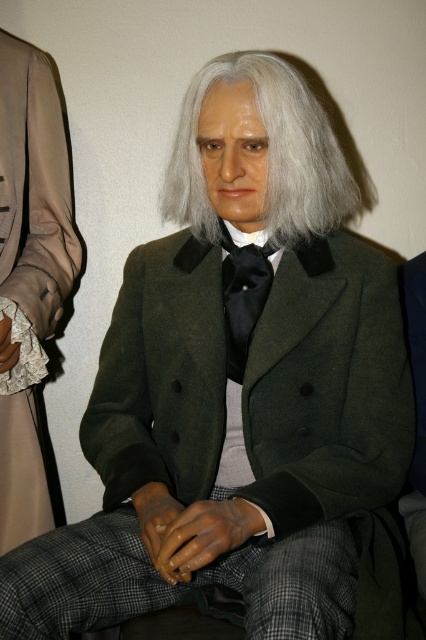
Based on the photo, you are a museum visitor standing in front of two wax figures. You notice the gray matte hair at center and the black satin tie at center. Which object is positioned to the right of the other?

The gray matte hair at center is to the right of the black satin tie at center.

You are an interior designer planning to place a decorative item between the lace fabric at left and the black satin tie at center. Considering their sizes, which object should you use as a reference for spacing?

The lace fabric at left is larger in size than the black satin tie at center, so you should use the lace fabric at left as the reference for spacing to ensure proper placement.